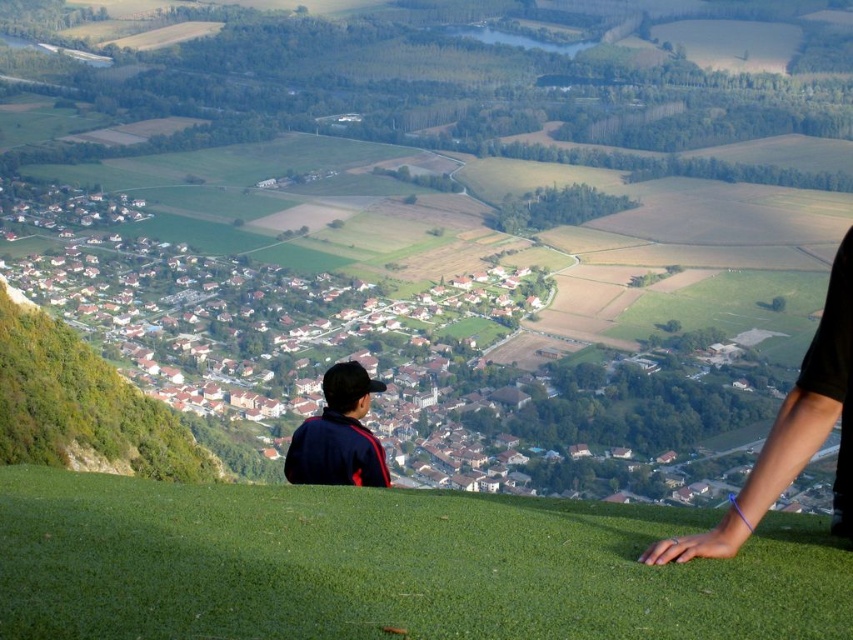
Which is more to the right, green grassy at lower center or dark blue jacket at center?

From the viewer's perspective, green grassy at lower center appears more on the right side.

Locate an element on the screen. The height and width of the screenshot is (640, 853). green grassy at lower center is located at coordinates (387, 566).

You are a GUI agent. You are given a task and a screenshot of the screen. Output one action in this format:
    pyautogui.click(x=<x>, y=<y>)
    Task: Click on the green grassy at lower center
    
    Given the screenshot: What is the action you would take?
    pyautogui.click(x=387, y=566)